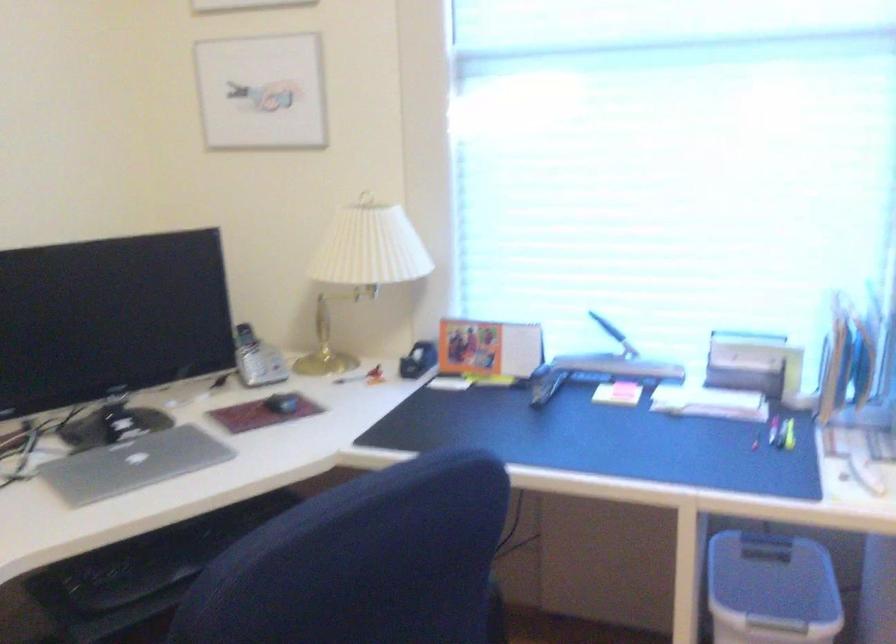
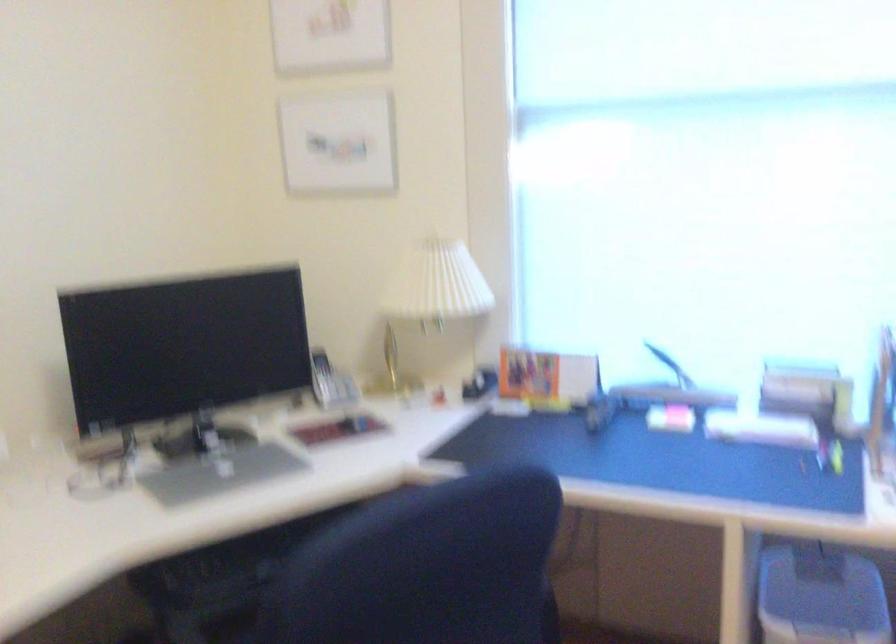
Question: In a continuous first-person perspective shot, in which direction is the camera moving?

Choices:
 (A) Left
 (B) Right
 (C) Forward
 (D) Backward

Answer: (D)